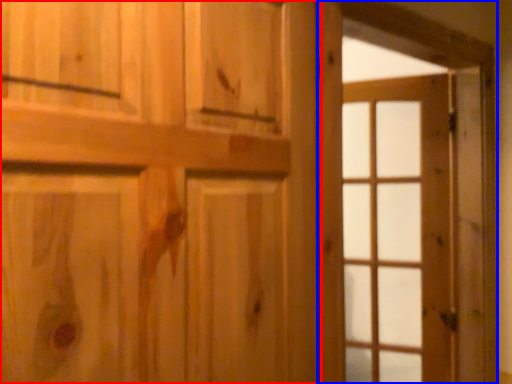
Question: Which object appears farthest to the camera in this image, door (highlighted by a red box) or barn door (highlighted by a blue box)?

Choices:
 (A) door
 (B) barn door

Answer: (B)